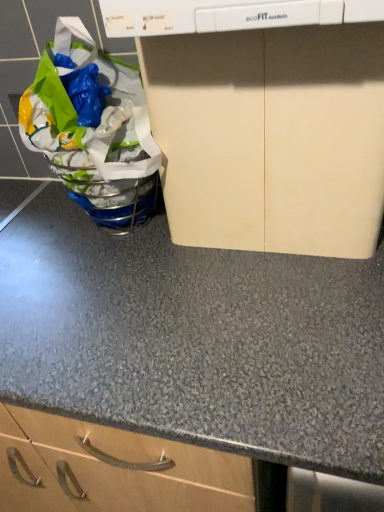
Identify the location of translucent plastic grocery bag at left. Image resolution: width=384 pixels, height=512 pixels. (89, 120).

What is the approximate width of translucent plastic grocery bag at left?

The width of translucent plastic grocery bag at left is 25.70 centimeters.

In order to face translucent plastic grocery bag at left, should I rotate leftwards or rightwards?

To align with it, rotate left about 12.220°.

Describe the element at coordinates (89, 120) in the screenshot. The height and width of the screenshot is (512, 384). I see `translucent plastic grocery bag at left` at that location.

What is the approximate height of beige matte cabinet at upper center?

beige matte cabinet at upper center is 14.99 inches tall.

I want to click on beige matte cabinet at upper center, so click(x=265, y=120).

What do you see at coordinates (265, 120) in the screenshot? I see `beige matte cabinet at upper center` at bounding box center [265, 120].

Locate an element on the screen. translucent plastic grocery bag at left is located at coordinates (89, 120).

Considering the relative positions of translucent plastic grocery bag at left and beige matte cabinet at upper center in the image provided, is translucent plastic grocery bag at left to the left or to the right of beige matte cabinet at upper center?

Clearly, translucent plastic grocery bag at left is on the left of beige matte cabinet at upper center in the image.

Who is more distant, translucent plastic grocery bag at left or beige matte cabinet at upper center?

Positioned behind is translucent plastic grocery bag at left.

Is point (38, 123) in front of point (160, 123)?

That is False.

From the image's perspective, between translucent plastic grocery bag at left and beige matte cabinet at upper center, which one is located above?

translucent plastic grocery bag at left, from the image's perspective.

From a real-world perspective, is translucent plastic grocery bag at left above or below beige matte cabinet at upper center?

translucent plastic grocery bag at left is above beige matte cabinet at upper center.

Based on the photo, between translucent plastic grocery bag at left and beige matte cabinet at upper center, which one has smaller width?

Thinner between the two is beige matte cabinet at upper center.

In terms of height, does translucent plastic grocery bag at left look taller or shorter compared to beige matte cabinet at upper center?

Clearly, translucent plastic grocery bag at left is taller compared to beige matte cabinet at upper center.

Considering the relative sizes of translucent plastic grocery bag at left and beige matte cabinet at upper center in the image provided, is translucent plastic grocery bag at left bigger than beige matte cabinet at upper center?

No.

Consider the image. Would you say translucent plastic grocery bag at left contains beige matte cabinet at upper center?

That's incorrect, beige matte cabinet at upper center is not inside translucent plastic grocery bag at left.

Would you consider translucent plastic grocery bag at left to be distant from beige matte cabinet at upper center?

No, translucent plastic grocery bag at left is not far away from beige matte cabinet at upper center.

In the scene shown: Is translucent plastic grocery bag at left oriented away from beige matte cabinet at upper center?

No, translucent plastic grocery bag at left is not facing away from beige matte cabinet at upper center.

Find the location of `grocery bag positioned vertically above the beige matte cabinet at upper center (from a real-world perspective)`. grocery bag positioned vertically above the beige matte cabinet at upper center (from a real-world perspective) is located at coordinates (89, 120).

Looking at this image, is beige matte cabinet at upper center to the right of translucent plastic grocery bag at left from the viewer's perspective?

Yes.

In the scene shown: Is beige matte cabinet at upper center closer to camera compared to translucent plastic grocery bag at left?

Yes, it is.

Between point (121, 13) and point (88, 147), which one is positioned behind?

Positioned behind is point (88, 147).

From the image's perspective, would you say beige matte cabinet at upper center is shown under translucent plastic grocery bag at left?

Yes, from the image's perspective, beige matte cabinet at upper center is below translucent plastic grocery bag at left.

From a real-world perspective, is beige matte cabinet at upper center physically located above or below translucent plastic grocery bag at left?

beige matte cabinet at upper center is situated lower than translucent plastic grocery bag at left in the real world.

Is beige matte cabinet at upper center wider or thinner than translucent plastic grocery bag at left?

beige matte cabinet at upper center is thinner than translucent plastic grocery bag at left.

Considering the relative sizes of beige matte cabinet at upper center and translucent plastic grocery bag at left in the image provided, is beige matte cabinet at upper center shorter than translucent plastic grocery bag at left?

Yes.

Considering the sizes of objects beige matte cabinet at upper center and translucent plastic grocery bag at left in the image provided, who is bigger, beige matte cabinet at upper center or translucent plastic grocery bag at left?

With larger size is beige matte cabinet at upper center.

Is beige matte cabinet at upper center inside the boundaries of translucent plastic grocery bag at left, or outside?

The correct answer is: outside.

Is the surface of beige matte cabinet at upper center in direct contact with translucent plastic grocery bag at left?

No, beige matte cabinet at upper center is not touching translucent plastic grocery bag at left.

Is beige matte cabinet at upper center looking in the opposite direction of translucent plastic grocery bag at left?

No, beige matte cabinet at upper center is not facing the opposite direction of translucent plastic grocery bag at left.

Measure the distance between beige matte cabinet at upper center and translucent plastic grocery bag at left.

7.44 inches.

Where is `home appliance lying on the right of translucent plastic grocery bag at left`? home appliance lying on the right of translucent plastic grocery bag at left is located at coordinates (265, 120).

Locate an element on the screen. This screenshot has height=512, width=384. home appliance located on the right of translucent plastic grocery bag at left is located at coordinates (265, 120).

Find the location of a particular element. This screenshot has height=512, width=384. grocery bag that is above the beige matte cabinet at upper center (from a real-world perspective) is located at coordinates (89, 120).